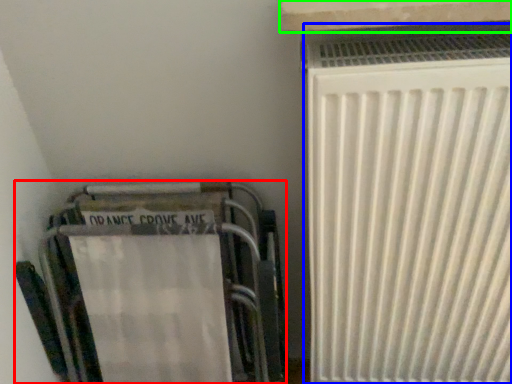
Question: Which object is positioned farthest from furniture (highlighted by a red box)? Select from radiator (highlighted by a blue box) and window sill (highlighted by a green box).

Choices:
 (A) radiator
 (B) window sill

Answer: (B)